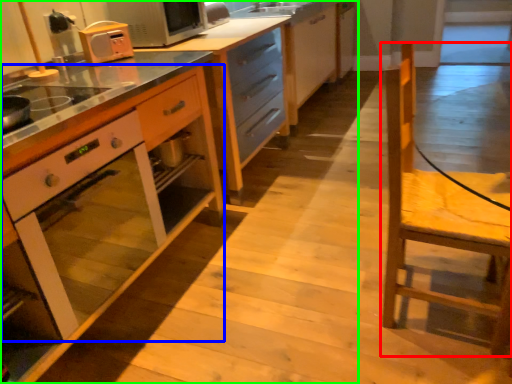
Question: Which object is the closest to the chair (highlighted by a red box)? Choose among these: oven (highlighted by a blue box) or cabinetry (highlighted by a green box).

Choices:
 (A) oven
 (B) cabinetry

Answer: (A)